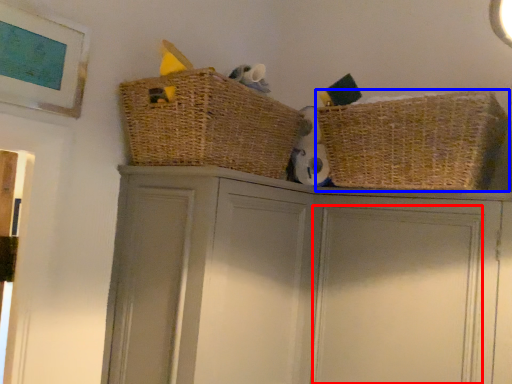
Question: Among these objects, which one is nearest to the camera, door (highlighted by a red box) or basket (highlighted by a blue box)?

Choices:
 (A) door
 (B) basket

Answer: (B)